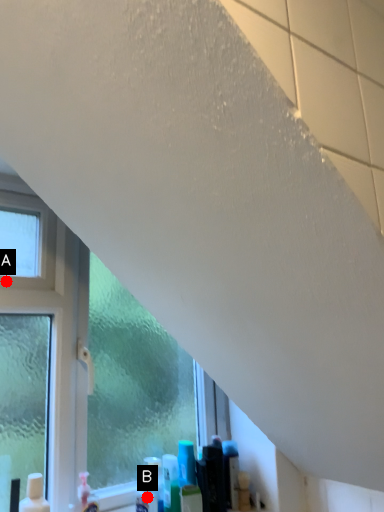
Question: Two points are circled on the image, labeled by A and B beside each circle. Among these points, which one is nearest to the camera?

Choices:
 (A) A is closer
 (B) B is closer

Answer: (A)